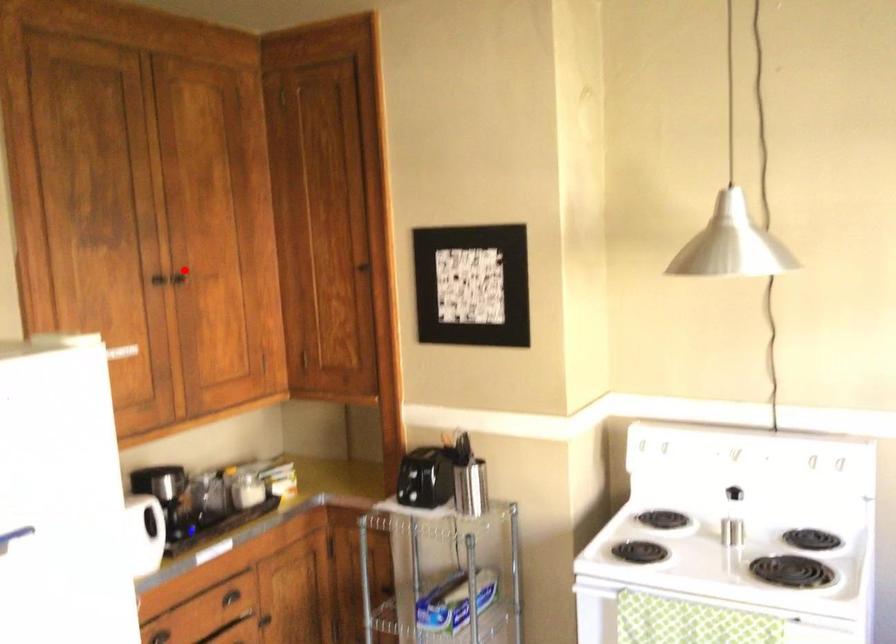
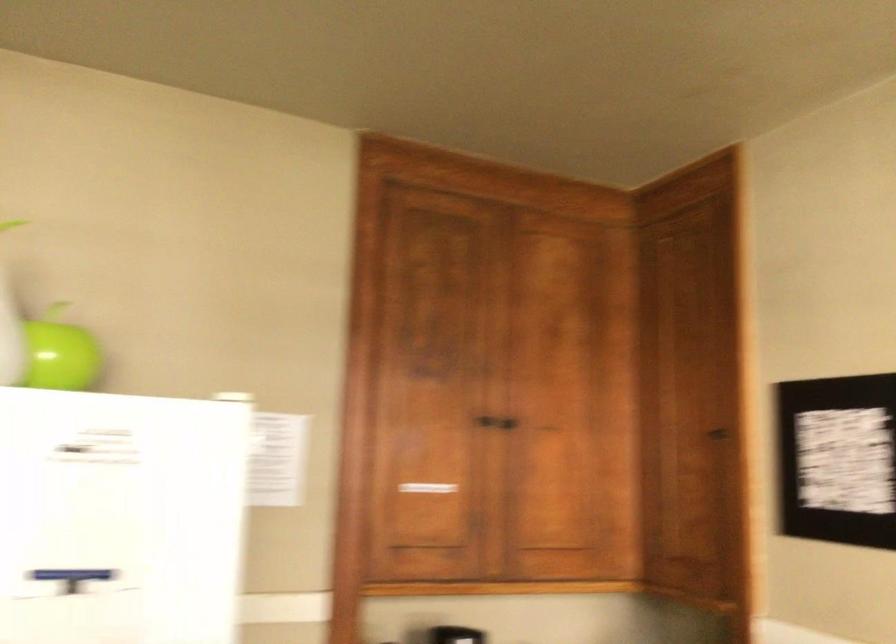
The point at the highlighted location is marked in the first image. Where is the corresponding point in the second image?

(511, 419)